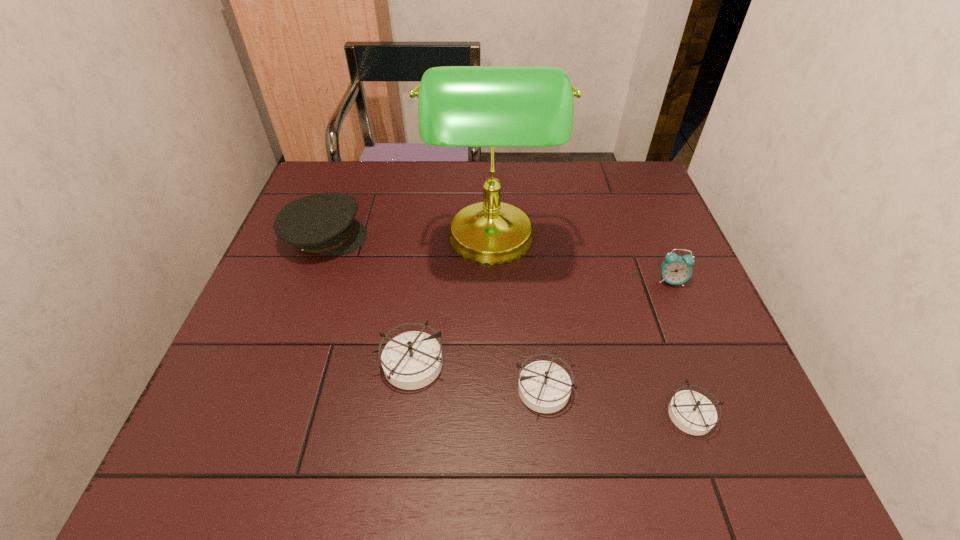
In the current image, all compasss are evenly spaced. To maintain this equal spacing, where should an additional compass be placed on the left? Please point out a free spot. Please provide its 2D coordinates. Your answer should be formatted as a tuple, i.e. [(x, y)], where the tuple contains the x and y coordinates of a point satisfying the conditions above.

[(288, 343)]